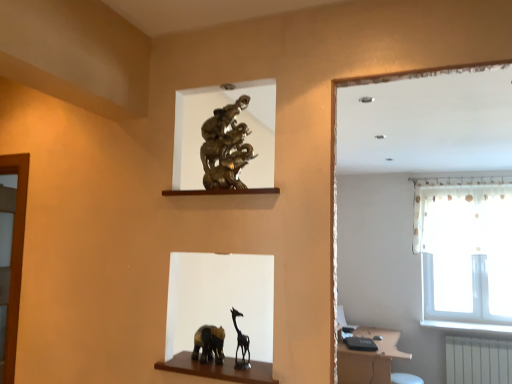
Find the location of a particular element. white sheer curtain at upper right is located at coordinates (448, 195).

The height and width of the screenshot is (384, 512). What are the coordinates of `matte brown vanity at lower right` in the screenshot? It's located at (369, 358).

Considering the sizes of white plastic radiator at lower right and white sheer curtain at upper right in the image, is white plastic radiator at lower right taller or shorter than white sheer curtain at upper right?

In the image, white plastic radiator at lower right appears to be shorter than white sheer curtain at upper right.

This screenshot has width=512, height=384. Identify the location of curtain on the left side of white plastic radiator at lower right. (448, 195).

Would you say white plastic radiator at lower right is a long distance from white sheer curtain at upper right?

Yes, white plastic radiator at lower right is far from white sheer curtain at upper right.

Considering the sizes of objects white plastic radiator at lower right and white sheer curtain at upper right in the image provided, who is smaller, white plastic radiator at lower right or white sheer curtain at upper right?

With smaller size is white plastic radiator at lower right.

Between point (493, 342) and point (359, 379), which one is positioned in front?

Point (359, 379)

Relative to matte brown vanity at lower right, is white plastic radiator at lower right in front or behind?

Clearly, white plastic radiator at lower right is behind matte brown vanity at lower right.

Which of these two, white plastic radiator at lower right or matte brown vanity at lower right, is smaller?

Smaller between the two is white plastic radiator at lower right.

Does point (375, 378) come farther from viewer compared to point (451, 179)?

No, it is not.

Which is correct: matte brown vanity at lower right is inside white sheer curtain at upper right, or outside of it?

matte brown vanity at lower right is not enclosed by white sheer curtain at upper right.

This screenshot has width=512, height=384. I want to click on curtain above the matte brown vanity at lower right (from the image's perspective), so click(x=448, y=195).

From the image's perspective, which object appears higher, matte brown vanity at lower right or white sheer curtain at upper right?

white sheer curtain at upper right appears higher in the image.

Is white sheer curtain at upper right positioned in front of matte brown vanity at lower right?

No.

Would you say matte brown vanity at lower right is part of white sheer curtain at upper right's contents?

No, matte brown vanity at lower right is located outside of white sheer curtain at upper right.

Between white sheer curtain at upper right and matte brown vanity at lower right, which one has larger size?

matte brown vanity at lower right.

Does point (433, 181) come closer to viewer compared to point (388, 351)?

No.

You are a GUI agent. You are given a task and a screenshot of the screen. Output one action in this format:
    pyautogui.click(x=<x>, y=<y>)
    Task: Click on the curtain located above the white plastic radiator at lower right (from a real-world perspective)
    
    Given the screenshot: What is the action you would take?
    pyautogui.click(x=448, y=195)

Could you tell me if white sheer curtain at upper right is facing white plastic radiator at lower right?

No, white sheer curtain at upper right does not turn towards white plastic radiator at lower right.

Is white sheer curtain at upper right far away from white plastic radiator at lower right?

Yes, white sheer curtain at upper right and white plastic radiator at lower right are quite far apart.

From a real-world perspective, does white sheer curtain at upper right stand above white plastic radiator at lower right?

Yes.

Is matte brown vanity at lower right closer to the viewer compared to white plastic radiator at lower right?

Yes.

Which is nearer, (339, 381) or (463, 376)?

Point (339, 381) appears to be closer to the viewer than point (463, 376).

Is matte brown vanity at lower right with white plastic radiator at lower right?

No, matte brown vanity at lower right is not touching white plastic radiator at lower right.

This screenshot has width=512, height=384. I want to click on curtain above the white plastic radiator at lower right (from the image's perspective), so click(x=448, y=195).

Locate an element on the screen. The height and width of the screenshot is (384, 512). radiator beneath the matte brown vanity at lower right (from a real-world perspective) is located at coordinates (478, 360).

Based on the photo, from the image, which object appears to be nearer to white plastic radiator at lower right, matte brown vanity at lower right or white sheer curtain at upper right?

Based on the image, matte brown vanity at lower right appears to be nearer to white plastic radiator at lower right.

From the image, which object appears to be nearer to white plastic radiator at lower right, white sheer curtain at upper right or matte brown vanity at lower right?

The object closer to white plastic radiator at lower right is matte brown vanity at lower right.

Based on their spatial positions, is matte brown vanity at lower right or white plastic radiator at lower right closer to white sheer curtain at upper right?

white plastic radiator at lower right is closer to white sheer curtain at upper right.

From the picture: Looking at the image, which one is located closer to white sheer curtain at upper right, white plastic radiator at lower right or matte brown vanity at lower right?

white plastic radiator at lower right is positioned closer to the anchor white sheer curtain at upper right.

Based on their spatial positions, is white sheer curtain at upper right or white plastic radiator at lower right further from matte brown vanity at lower right?

Based on the image, white sheer curtain at upper right appears to be further to matte brown vanity at lower right.

Estimate the real-world distances between objects in this image. Which object is closer to matte brown vanity at lower right, white plastic radiator at lower right or white sheer curtain at upper right?

white plastic radiator at lower right lies closer to matte brown vanity at lower right than the other object.

You are a GUI agent. You are given a task and a screenshot of the screen. Output one action in this format:
    pyautogui.click(x=<x>, y=<y>)
    Task: Click on the vanity between white sheer curtain at upper right and white plastic radiator at lower right from top to bottom
    The width and height of the screenshot is (512, 384).
    Given the screenshot: What is the action you would take?
    pyautogui.click(x=369, y=358)